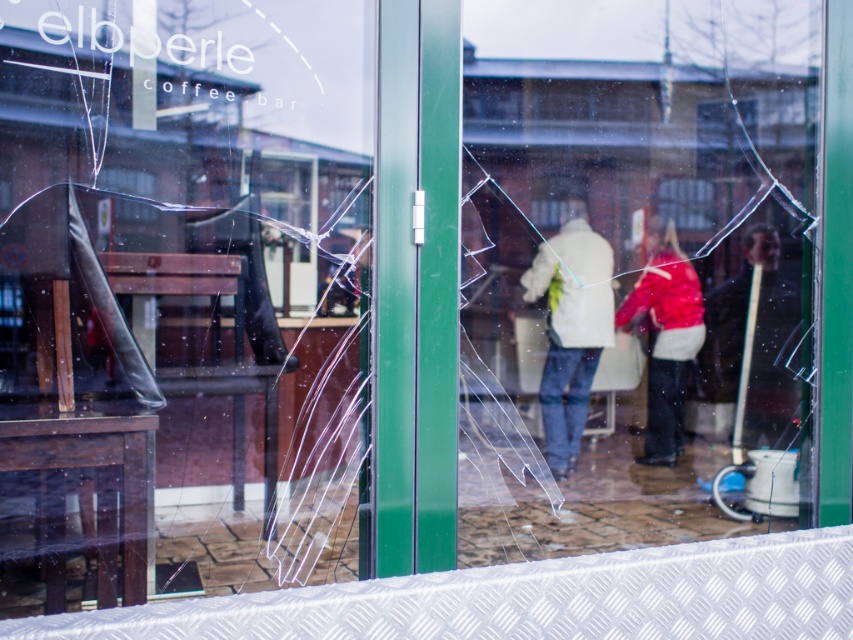
Who is positioned more to the right, transparent glass shop window at center or red matte jacket at center?

Positioned to the right is red matte jacket at center.

Locate an element on the screen. The width and height of the screenshot is (853, 640). transparent glass shop window at center is located at coordinates (172, 307).

Is point (573, 324) in front of point (648, 388)?

Yes.

Locate an element on the screen. This screenshot has width=853, height=640. white matte jacket at center is located at coordinates (570, 326).

Between point (525, 300) and point (699, 317), which one is positioned behind?

Point (525, 300)

Find the location of a particular element. This screenshot has height=640, width=853. white matte jacket at center is located at coordinates (570, 326).

Between white matte jacket at center and dark brown leather jacket at right, which one appears on the right side from the viewer's perspective?

From the viewer's perspective, dark brown leather jacket at right appears more on the right side.

Based on the photo, can you confirm if white matte jacket at center is positioned below dark brown leather jacket at right?

Correct, white matte jacket at center is located below dark brown leather jacket at right.

Does point (548, 442) come closer to viewer compared to point (738, 369)?

Yes, it is in front of point (738, 369).

The height and width of the screenshot is (640, 853). I want to click on white matte jacket at center, so click(x=570, y=326).